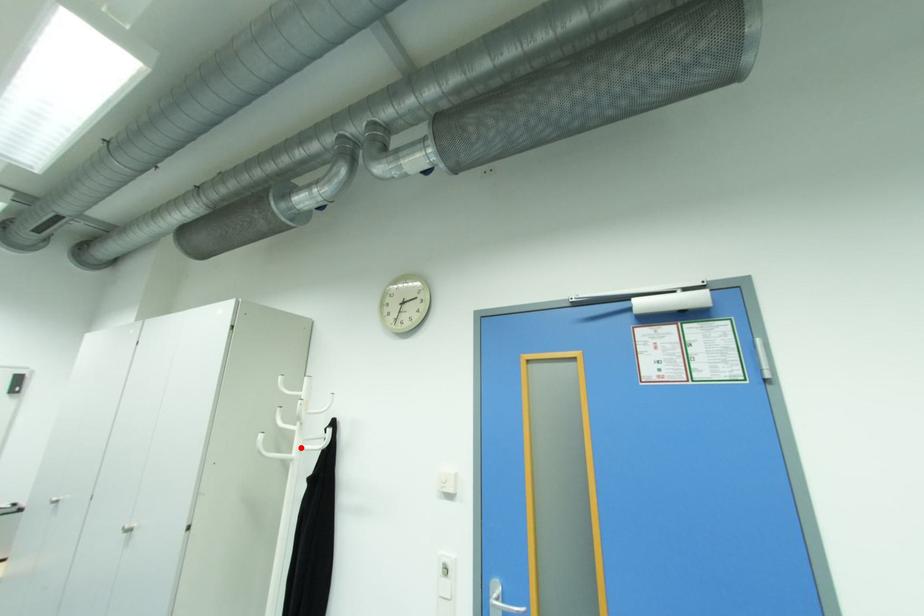
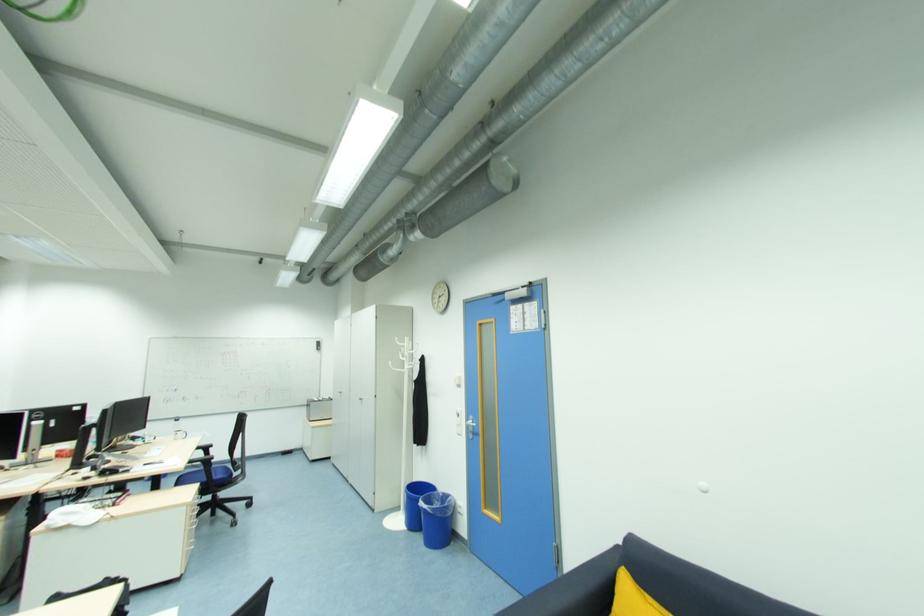
Where in the second image is the point corresponding to the highlighted location from the first image?

(409, 368)